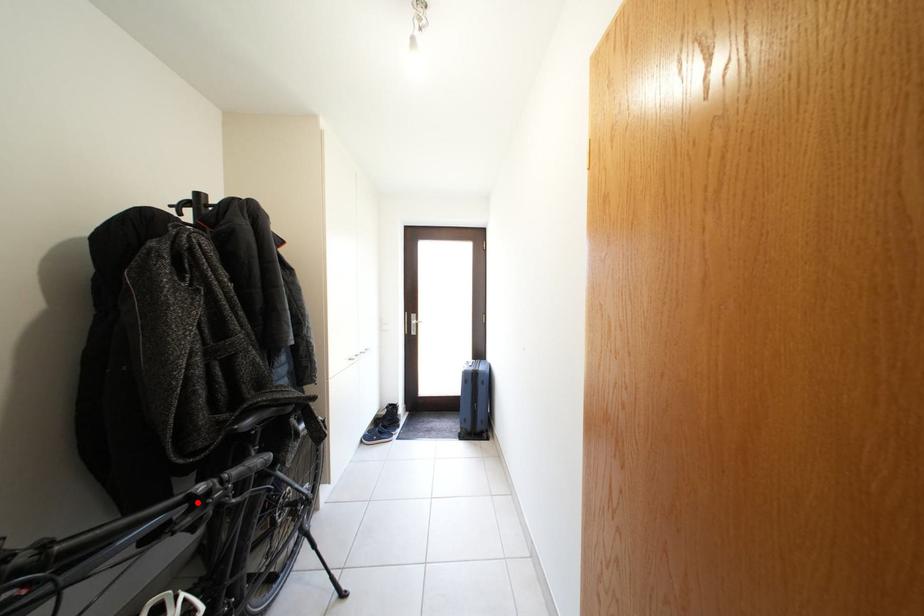
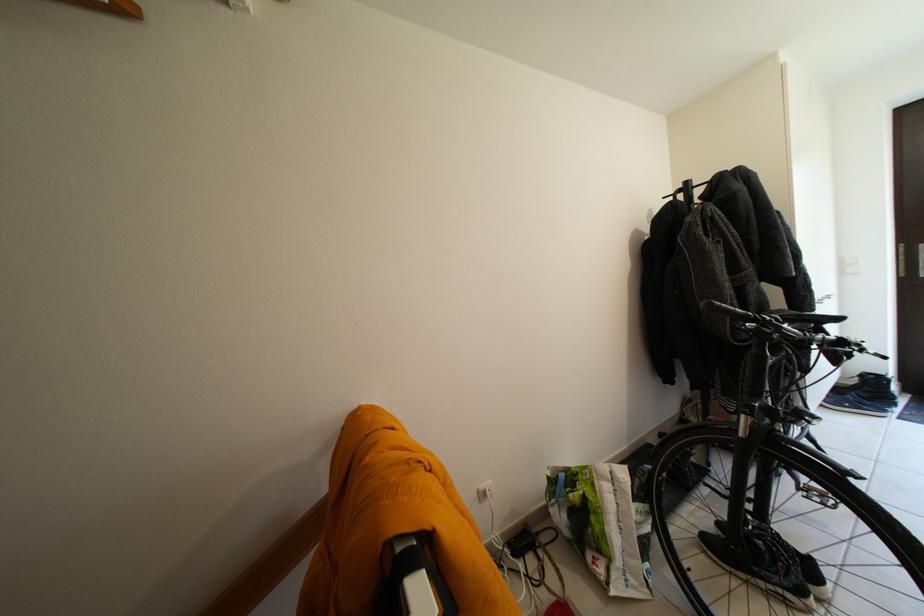
Question: A red point is marked in image1. In image2, is the corresponding 3D point closer to the camera or farther? Reply with the corresponding letter.

Choices:
 (A) The corresponding 3D point is closer.
 (B) The corresponding 3D point is farther.

Answer: (A)